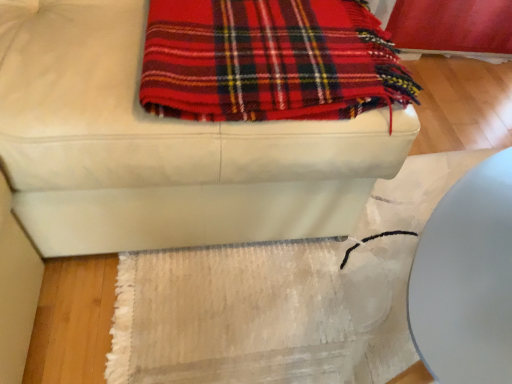
Question: Does white leather ottoman at upper center have a lesser height compared to white textured mat at lower center?

Choices:
 (A) yes
 (B) no

Answer: (B)

Question: Is white leather ottoman at upper center oriented towards white textured mat at lower center?

Choices:
 (A) yes
 (B) no

Answer: (B)

Question: Is white leather ottoman at upper center next to white textured mat at lower center?

Choices:
 (A) yes
 (B) no

Answer: (B)

Question: Does white leather ottoman at upper center appear on the left side of white textured mat at lower center?

Choices:
 (A) yes
 (B) no

Answer: (A)

Question: Is white leather ottoman at upper center completely or partially outside of white textured mat at lower center?

Choices:
 (A) yes
 (B) no

Answer: (A)

Question: From a real-world perspective, is white leather ottoman at upper center located higher than white textured mat at lower center?

Choices:
 (A) yes
 (B) no

Answer: (A)

Question: Can you confirm if white leather ottoman at upper center is positioned to the left of red plaid blanket at upper center?

Choices:
 (A) yes
 (B) no

Answer: (A)

Question: Can you confirm if white leather ottoman at upper center is taller than red plaid blanket at upper center?

Choices:
 (A) yes
 (B) no

Answer: (A)

Question: Are white leather ottoman at upper center and red plaid blanket at upper center beside each other?

Choices:
 (A) yes
 (B) no

Answer: (B)

Question: Considering the relative sizes of white leather ottoman at upper center and red plaid blanket at upper center in the image provided, is white leather ottoman at upper center thinner than red plaid blanket at upper center?

Choices:
 (A) yes
 (B) no

Answer: (B)

Question: Is white leather ottoman at upper center oriented towards red plaid blanket at upper center?

Choices:
 (A) yes
 (B) no

Answer: (A)

Question: Considering the relative sizes of white leather ottoman at upper center and red plaid blanket at upper center in the image provided, is white leather ottoman at upper center bigger than red plaid blanket at upper center?

Choices:
 (A) no
 (B) yes

Answer: (B)

Question: Does white textured mat at lower center appear on the right side of red plaid blanket at upper center?

Choices:
 (A) yes
 (B) no

Answer: (A)